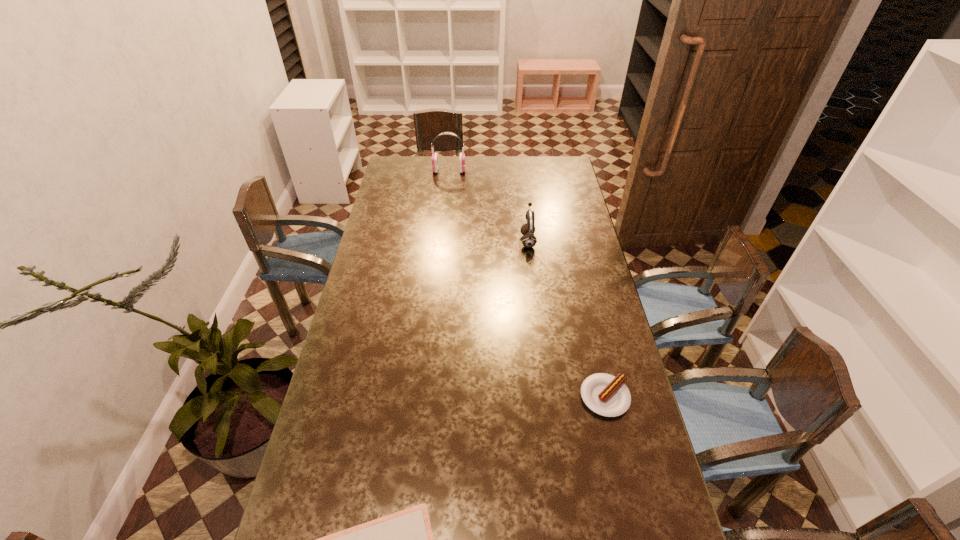
This screenshot has width=960, height=540. What are the coordinates of `free space between the farthest object and the third farthest object` in the screenshot? It's located at (527, 284).

Identify the location of free space that is in between the third tallest object and the left earphone. (527, 284).

At what (x,y) coordinates should I click in order to perform the action: click on vacant point located between the left earphone and the rightmost object. Please return your answer as a coordinate pair (x, y). Looking at the image, I should click on (527, 284).

Identify the location of object that is the second closest to the shortest object. click(x=529, y=240).

Locate an element on the screen. The width and height of the screenshot is (960, 540). object that is the second closest to the second object from right to left is located at coordinates (606, 395).

Identify the location of free space that satisfies the following two spatial constraints: 1. on the outer surface of the third tallest object; 2. on the right side of the left earphone. This screenshot has height=540, width=960. (427, 397).

Where is `free space that satisfies the following two spatial constraints: 1. on the outer surface of the third tallest object; 2. on the left side of the farthest object`? This screenshot has height=540, width=960. free space that satisfies the following two spatial constraints: 1. on the outer surface of the third tallest object; 2. on the left side of the farthest object is located at coordinates (427, 397).

Locate an element on the screen. free location that satisfies the following two spatial constraints: 1. on the ear pads of the second object from right to left; 2. on the back side of the rightmost object is located at coordinates (547, 397).

At what (x,y) coordinates should I click in order to perform the action: click on free space that satisfies the following two spatial constraints: 1. on the ear pads of the right earphone; 2. on the left side of the rightmost object. Please return your answer as a coordinate pair (x, y). The width and height of the screenshot is (960, 540). Looking at the image, I should click on (547, 397).